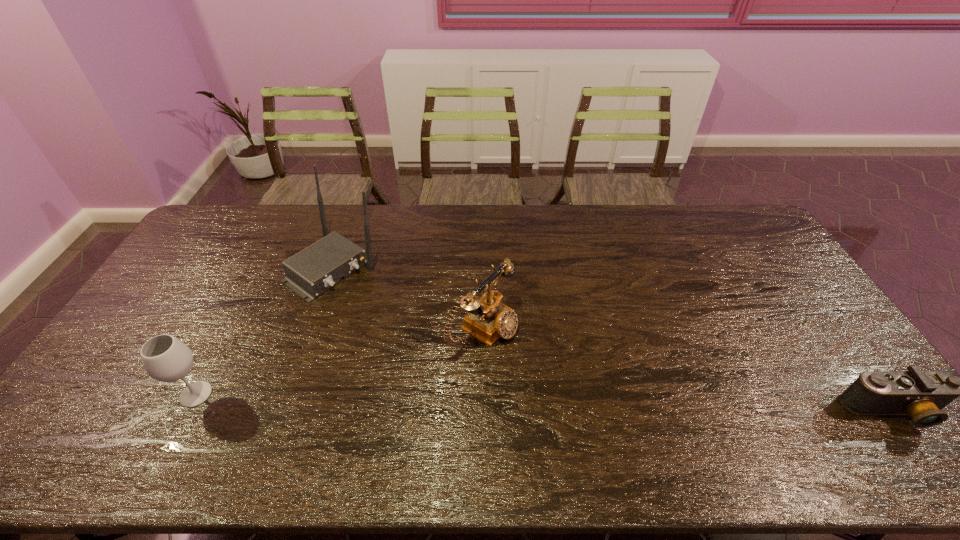
You are a GUI agent. You are given a task and a screenshot of the screen. Output one action in this format:
    pyautogui.click(x=<x>, y=<y>)
    Task: Click on the vacant point located 0.330m on the dial number of the telephone
    Image resolution: width=960 pixels, height=540 pixels.
    Given the screenshot: What is the action you would take?
    pyautogui.click(x=620, y=414)

I want to click on vacant space located on the dial number of the telephone, so click(632, 421).

In order to click on vacant space located on the dial number of the telephone in this screenshot , I will do `click(551, 373)`.

This screenshot has width=960, height=540. I want to click on object at the far edge, so click(315, 269).

This screenshot has width=960, height=540. Identify the location of wineglass that is at the near edge. (165, 358).

Find the location of `camera that is at the near edge`. camera that is at the near edge is located at coordinates (920, 394).

Find the location of a particular element. This screenshot has width=960, height=540. object present at the right edge is located at coordinates (920, 394).

The image size is (960, 540). In order to click on object that is at the near right corner in this screenshot , I will do `click(920, 394)`.

The image size is (960, 540). In the image, there is a desktop. In order to click on vacant region at the far edge in this screenshot , I will do `click(714, 232)`.

Locate an element on the screen. This screenshot has height=540, width=960. blank space at the near edge of the desktop is located at coordinates coord(461,421).